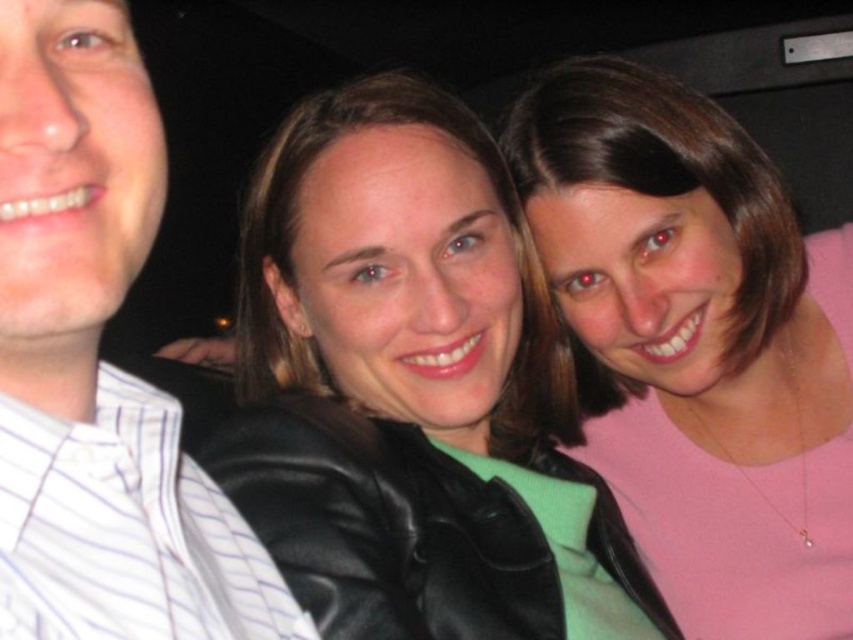
Locate an element on the screen. The width and height of the screenshot is (853, 640). black leather jacket at center is located at coordinates (412, 388).

This screenshot has height=640, width=853. What are the coordinates of `black leather jacket at center` in the screenshot? It's located at click(412, 388).

You are a GUI agent. You are given a task and a screenshot of the screen. Output one action in this format:
    pyautogui.click(x=<x>, y=<y>)
    Task: Click on the black leather jacket at center
    The image size is (853, 640).
    Given the screenshot: What is the action you would take?
    pyautogui.click(x=412, y=388)

Is black leather jacket at center above white striped shirt at left?

No.

Which is below, black leather jacket at center or white striped shirt at left?

black leather jacket at center is below.

You are a GUI agent. You are given a task and a screenshot of the screen. Output one action in this format:
    pyautogui.click(x=<x>, y=<y>)
    Task: Click on the black leather jacket at center
    The height and width of the screenshot is (640, 853).
    Given the screenshot: What is the action you would take?
    pyautogui.click(x=412, y=388)

At what (x,y) coordinates should I click in order to perform the action: click on black leather jacket at center. Please return your answer as a coordinate pair (x, y). This screenshot has height=640, width=853. Looking at the image, I should click on (412, 388).

Between pink matte shirt at center and white striped shirt at left, which one has less height?

white striped shirt at left is shorter.

Who is lower down, pink matte shirt at center or white striped shirt at left?

white striped shirt at left

Describe the element at coordinates (698, 346) in the screenshot. I see `pink matte shirt at center` at that location.

Image resolution: width=853 pixels, height=640 pixels. Find the location of `pink matte shirt at center`. pink matte shirt at center is located at coordinates (698, 346).